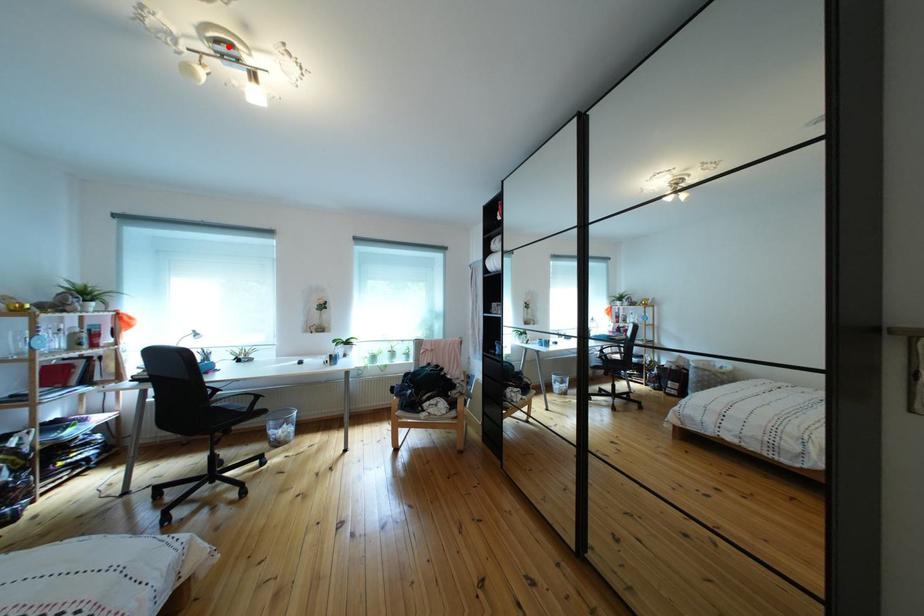
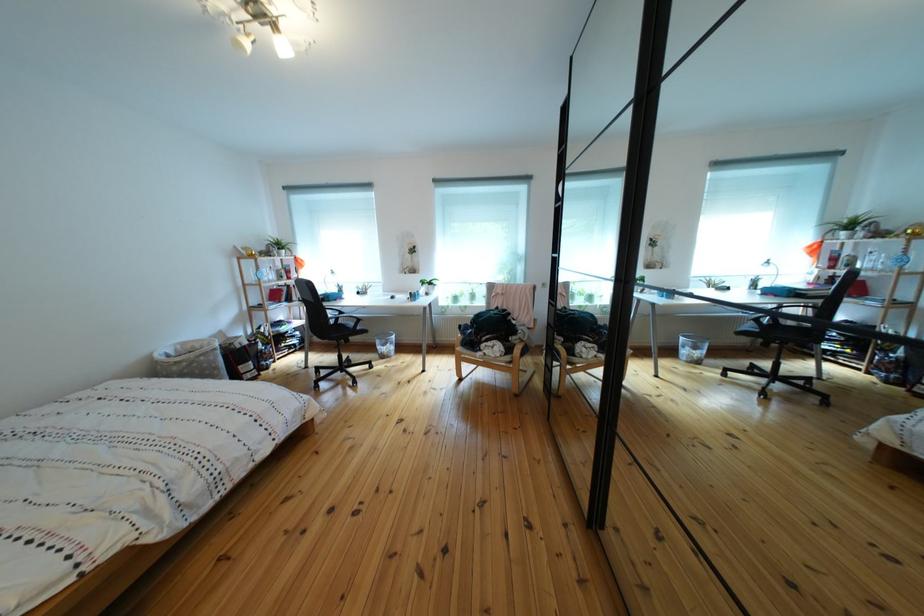
The point at the highlighted location is marked in the first image. Where is the corresponding point in the second image?

(258, 10)